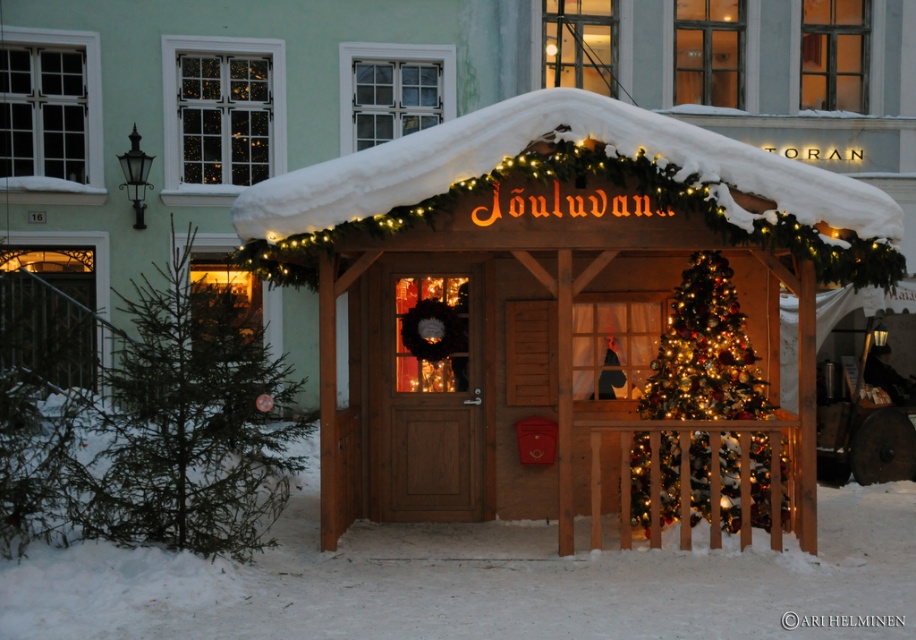
Can you confirm if wooden gazebo at center is shorter than iridescent glass christmas tree at center?

No.

Which is in front, point (724, 154) or point (759, 372)?

Positioned in front is point (724, 154).

Identify the location of wooden gazebo at center. (565, 296).

Which is in front, point (732, 216) or point (386, 285)?

Point (732, 216) is in front.

Who is positioned more to the right, snow-covered wooden canopy at center or wooden door at center?

snow-covered wooden canopy at center

Who is more forward, (674, 145) or (451, 518)?

Point (674, 145)

Where is `snow-covered wooden canopy at center`? snow-covered wooden canopy at center is located at coordinates (576, 186).

Is wooden gazebo at center closer to the viewer compared to snow-covered wooden canopy at center?

That is False.

Who is more distant from viewer, (622, 228) or (432, 134)?

Point (622, 228)

Which is in front, point (575, 208) or point (266, 260)?

Point (575, 208) is more forward.

This screenshot has width=916, height=640. Find the location of `wooden gazebo at center`. wooden gazebo at center is located at coordinates (565, 296).